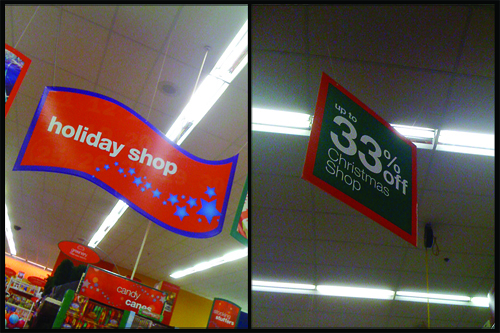
Image resolution: width=500 pixels, height=333 pixels. Find the location of `light`. light is located at coordinates 460,139.